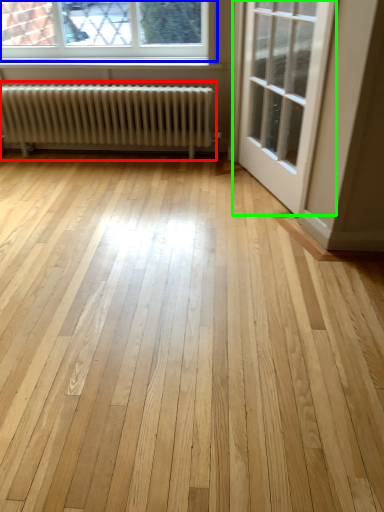
Question: Considering the real-world distances, which object is closest to radiator (highlighted by a red box)? window (highlighted by a blue box) or door (highlighted by a green box).

Choices:
 (A) window
 (B) door

Answer: (A)